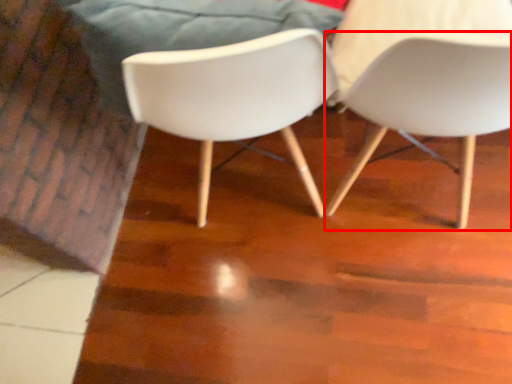
Question: Where is chair (annotated by the red box) located in relation to chair in the image?

Choices:
 (A) left
 (B) right

Answer: (B)